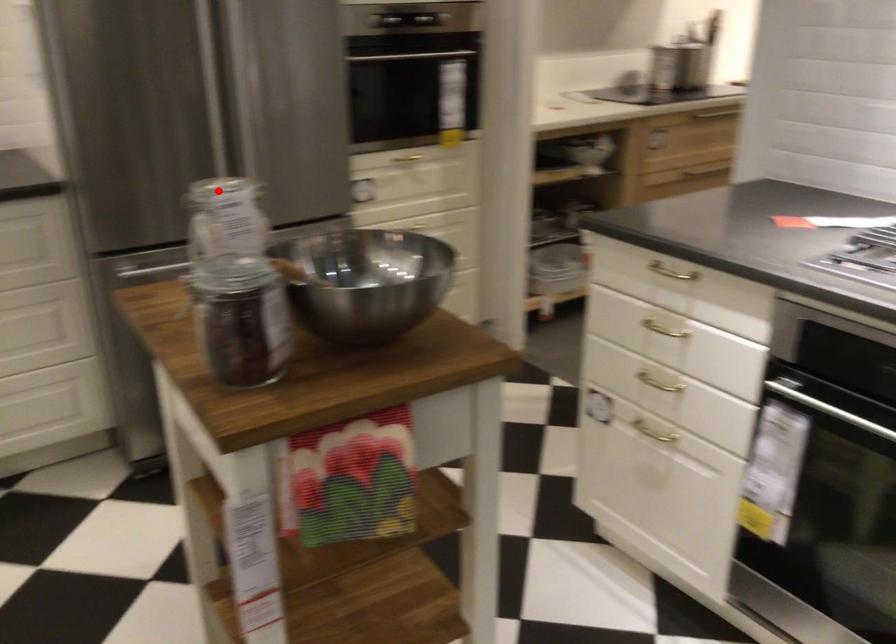
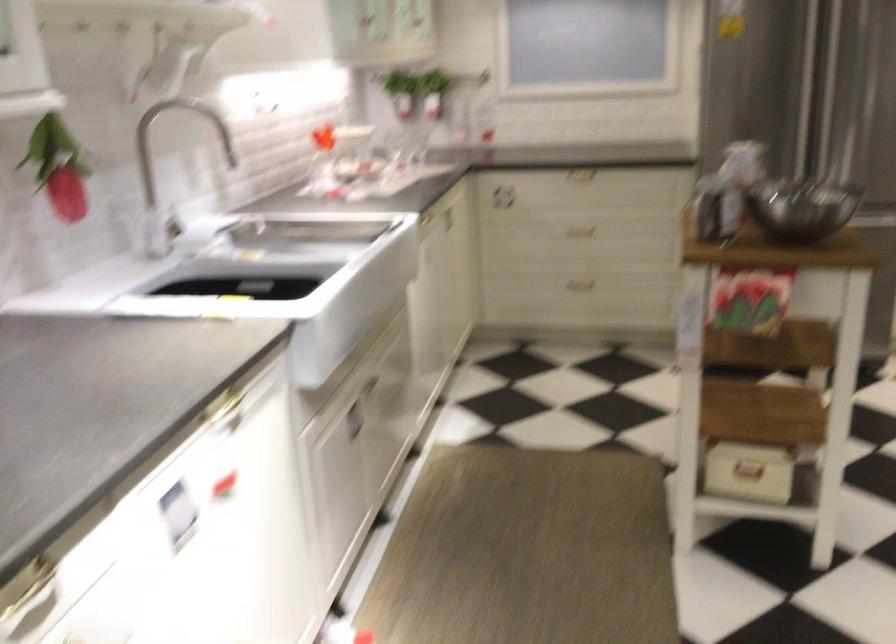
The point at the highlighted location is marked in the first image. Where is the corresponding point in the second image?

(728, 138)